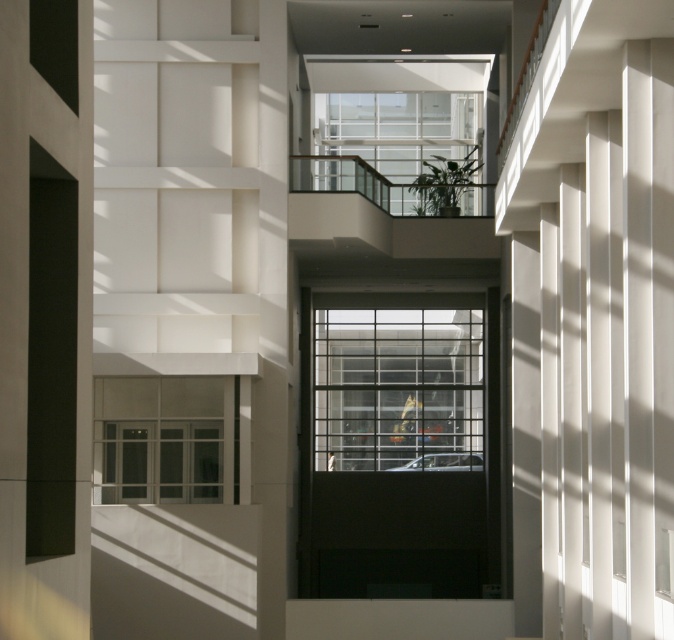
Is clear glass window at lower center to the left of clear glass window at upper center from the viewer's perspective?

Yes, clear glass window at lower center is to the left of clear glass window at upper center.

What do you see at coordinates (164, 440) in the screenshot? I see `clear glass window at lower center` at bounding box center [164, 440].

Find the location of `clear glass window at lower center`. clear glass window at lower center is located at coordinates (164, 440).

Identify the location of clear glass window at center. (398, 388).

Which of these two, clear glass window at center or clear glass window at lower center, stands taller?

clear glass window at lower center

Locate an element on the screen. The image size is (674, 640). clear glass window at center is located at coordinates (398, 388).

Identify the location of clear glass window at center. Image resolution: width=674 pixels, height=640 pixels. (398, 388).

Is clear glass window at center taller than clear glass window at upper center?

No.

Which of these two, clear glass window at center or clear glass window at upper center, stands taller?

Standing taller between the two is clear glass window at upper center.

Find the location of `clear glass window at center`. clear glass window at center is located at coordinates (398, 388).